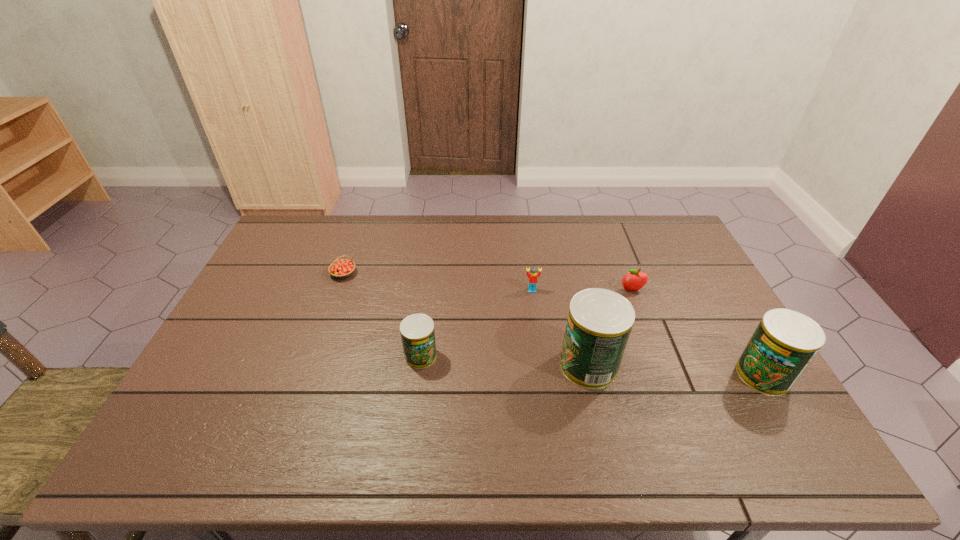
Find the location of a particular element. Image resolution: width=960 pixels, height=540 pixels. the fourth shortest object is located at coordinates (417, 331).

Locate an element on the screen. This screenshot has width=960, height=540. the shortest can is located at coordinates (417, 331).

You are a GUI agent. You are given a task and a screenshot of the screen. Output one action in this format:
    pyautogui.click(x=<x>, y=<y>)
    Task: Click on the second can from left to right
    
    Given the screenshot: What is the action you would take?
    pyautogui.click(x=599, y=323)

Locate an element on the screen. the second shortest can is located at coordinates (784, 343).

Where is `the second tallest object`? This screenshot has width=960, height=540. the second tallest object is located at coordinates (784, 343).

This screenshot has width=960, height=540. In order to click on the leftmost object in this screenshot , I will do `click(343, 268)`.

This screenshot has height=540, width=960. I want to click on the shortest object, so click(343, 268).

Image resolution: width=960 pixels, height=540 pixels. What are the coordinates of `Lego` in the screenshot? It's located at 533,276.

At what (x,y) coordinates should I click in order to perform the action: click on the second object from right to left. Please return your answer as a coordinate pair (x, y). The height and width of the screenshot is (540, 960). Looking at the image, I should click on (635, 280).

Where is `vacant space located on the left of the fourth shortest object`? The height and width of the screenshot is (540, 960). vacant space located on the left of the fourth shortest object is located at coordinates (321, 356).